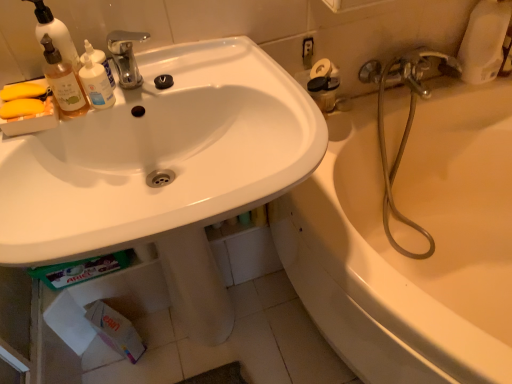
Where is `free spot behind polished chrome faucet at upper center`? The image size is (512, 384). free spot behind polished chrome faucet at upper center is located at coordinates (159, 65).